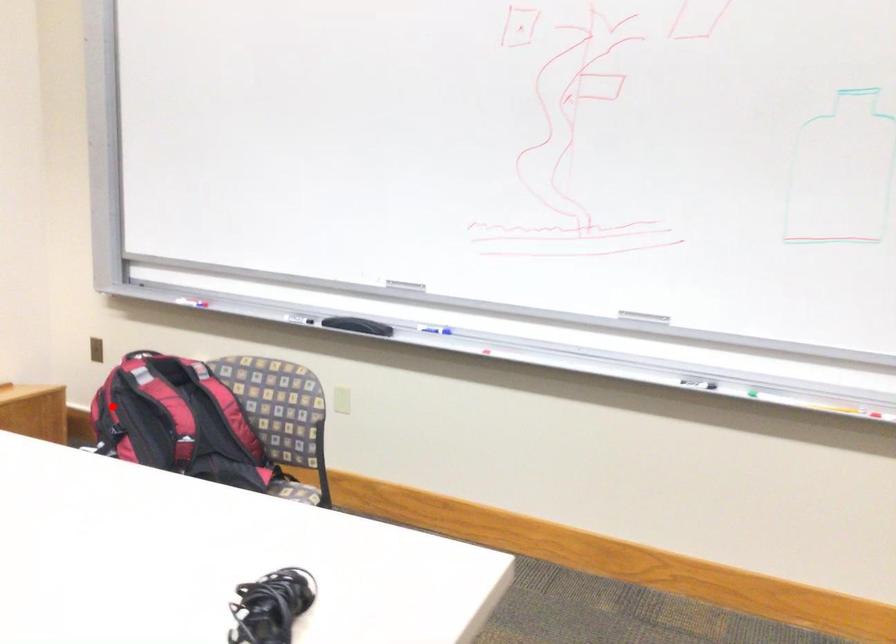
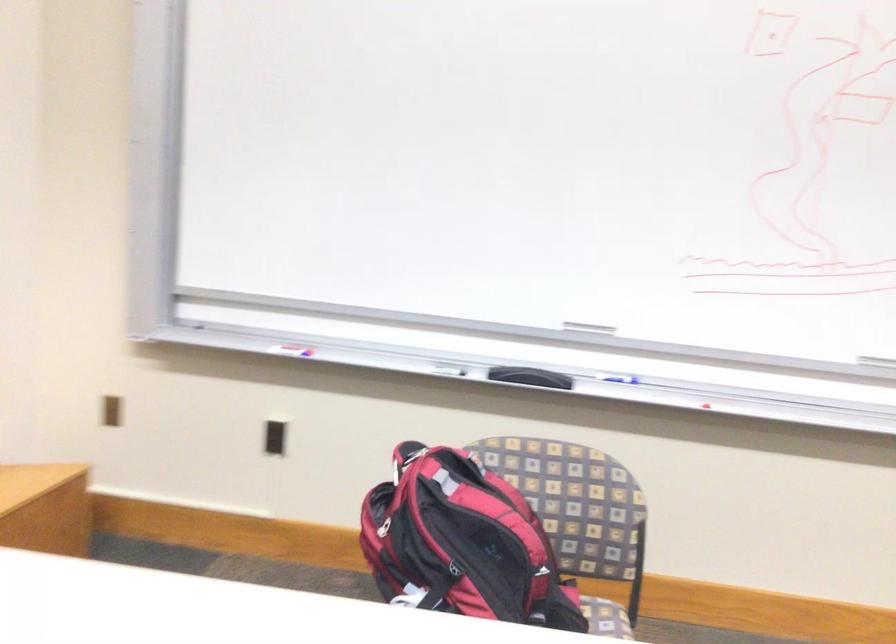
Question: I am providing you with two images of the same scene from different viewpoints. Given a red point in image1, look at the same physical point in image2. Is it:

Choices:
 (A) Closer to the viewpoint
 (B) Farther from the viewpoint

Answer: (A)